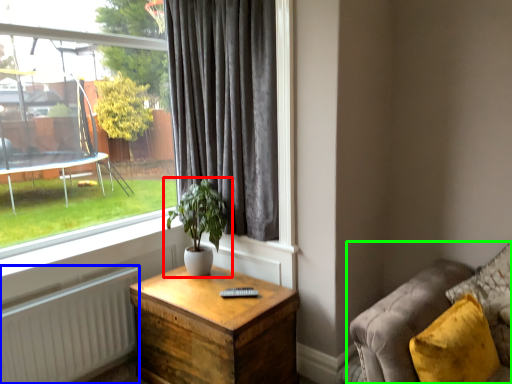
Question: Considering the real-world distances, which object is farthest from houseplant (highlighted by a red box)? radiator (highlighted by a blue box) or studio couch (highlighted by a green box)?

Choices:
 (A) radiator
 (B) studio couch

Answer: (B)